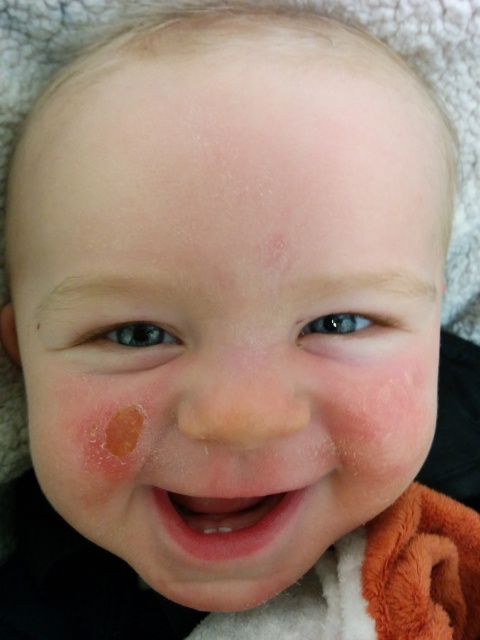
Can you confirm if smooth flesh-colored nose at center is positioned above pink smooth flesh at center?

Correct, smooth flesh-colored nose at center is located above pink smooth flesh at center.

Between point (252, 380) and point (230, 502), which one is positioned behind?

Point (230, 502)

Which is behind, point (204, 401) or point (229, 516)?

The point (229, 516) is behind.

Locate an element on the screen. smooth flesh-colored nose at center is located at coordinates (240, 401).